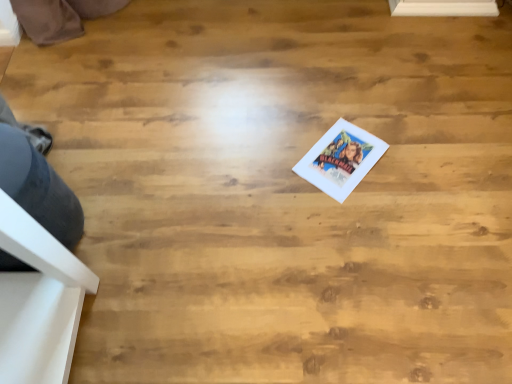
Identify the location of vacant space behind gray fabric shoe at lower left. (88, 151).